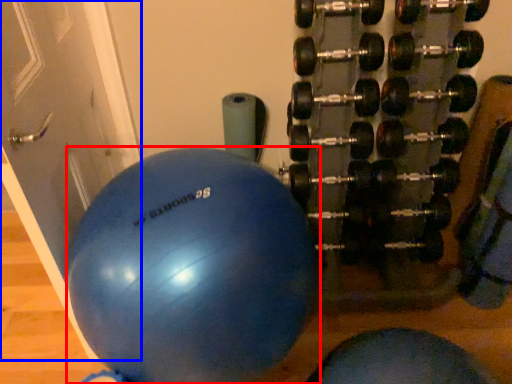
Question: Which of the following is the farthest to the observer, ball (highlighted by a red box) or door (highlighted by a blue box)?

Choices:
 (A) ball
 (B) door

Answer: (A)